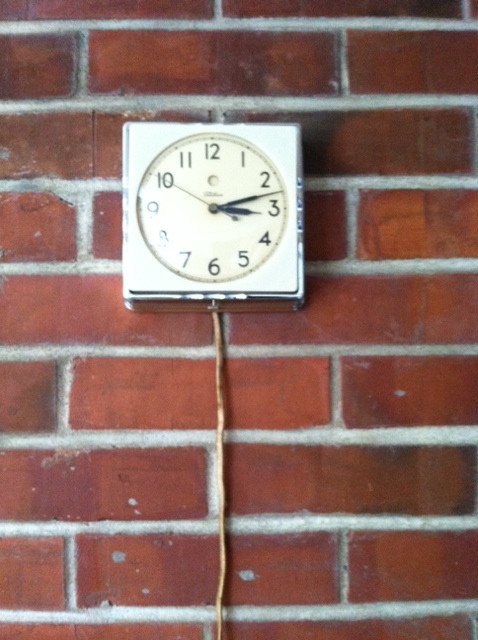
Where is `cord`? This screenshot has height=640, width=478. cord is located at coordinates (218, 460).